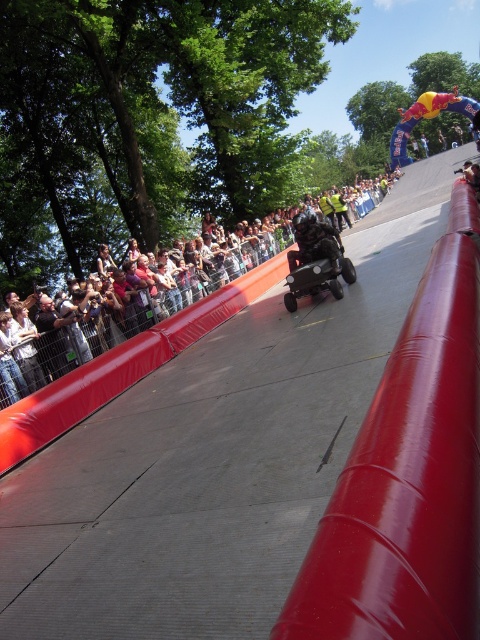
Between smooth rubber rail at center right and matte black crowd at left, which one appears on the right side from the viewer's perspective?

Positioned to the right is matte black crowd at left.

Is smooth rubber rail at center right above matte black crowd at left?

Incorrect, smooth rubber rail at center right is not positioned above matte black crowd at left.

Between point (393, 632) and point (295, 273), which one is positioned in front?

Point (393, 632)

At what (x,y) coordinates should I click in order to perform the action: click on smooth rubber rail at center right. Please return your answer as a coordinate pair (x, y). The height and width of the screenshot is (640, 480). Looking at the image, I should click on (408, 474).